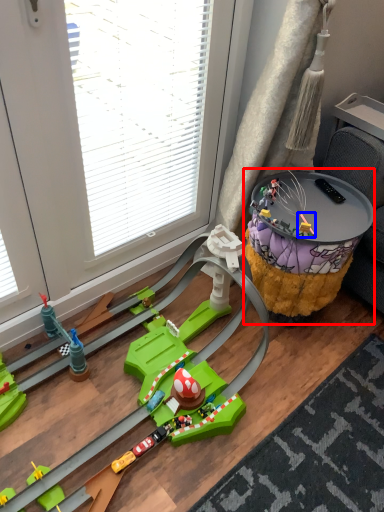
Question: Which of the following is the farthest to the observer, table (highlighted by a red box) or toy (highlighted by a blue box)?

Choices:
 (A) table
 (B) toy

Answer: (B)